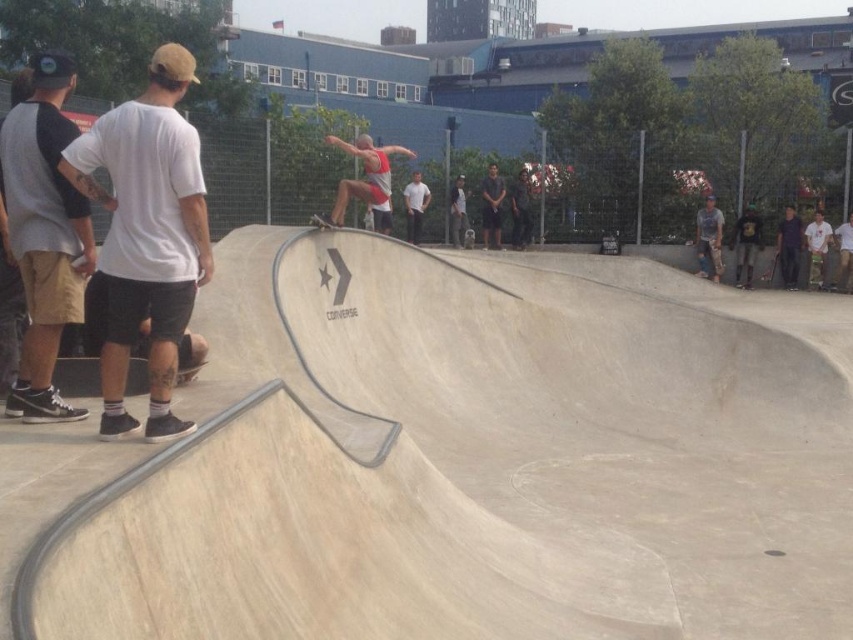
You are standing at the point marked as point (131, 365) in the skatepark. You want to throw a frisbee to a friend who is standing 5 meters away from you. Is your friend within reach?

The distance between point (131, 365) and the viewer is 5.15 meters, so the friend is slightly out of reach since 5.15 meters is more than 5 meters.

You are a photographer trying to capture the skateboarder midair. You see the dark blue jeans at right and the smooth beige skateboard at center. Which object is closer to the right edge of the photo?

The dark blue jeans at right is positioned on the right side of smooth beige skateboard at center, so it is closer to the right edge of the photo.

You are a skateboarder at the skatepark and want to choose a skateboard that is wider for better stability. Which one between the wooden skateboard at lower right and the smooth beige skateboard at center should you pick?

The wooden skateboard at lower right has a larger width compared to the smooth beige skateboard at center, so you should pick the wooden skateboard at lower right for better stability.